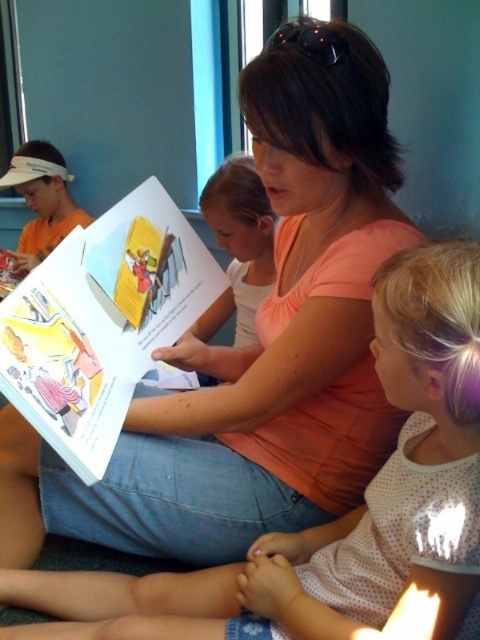
You are standing in the room and see the point at coordinates (348, 513). Based on the scene description, can you tell me what object or feature this point is located on?

The point at coordinates (348, 513) is located on the polka dot fabric dress at lower right.

You are a tailor trying to decide if the polka dot fabric dress at lower right can be placed on a table next to the matte paper book at center without overlapping. The table is only wide enough for one of them. Which object should you choose to fit on the table?

The polka dot fabric dress at lower right might be wider than the matte paper book at center, so it is possible that the dress would not fit on the table if the book is already placed there. Therefore, the matte paper book at center is more likely to fit on the table without overlapping.